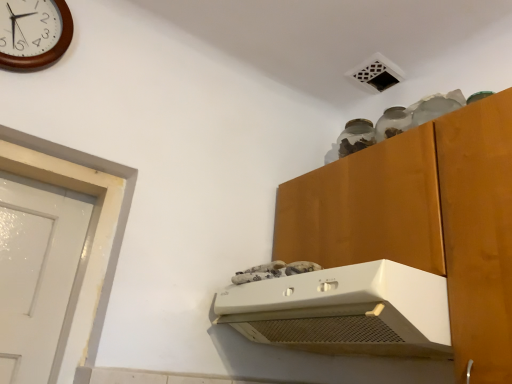
Question: Is white plastic range hood at upper center surrounded by wooden clock at upper left?

Choices:
 (A) yes
 (B) no

Answer: (B)

Question: From the image's perspective, is wooden clock at upper left over white plastic range hood at upper center?

Choices:
 (A) no
 (B) yes

Answer: (B)

Question: From the image's perspective, is wooden clock at upper left under white plastic range hood at upper center?

Choices:
 (A) yes
 (B) no

Answer: (B)

Question: Is wooden clock at upper left beside white plastic range hood at upper center?

Choices:
 (A) yes
 (B) no

Answer: (B)

Question: From a real-world perspective, does wooden clock at upper left sit lower than white plastic range hood at upper center?

Choices:
 (A) yes
 (B) no

Answer: (B)

Question: Considering the relative sizes of wooden clock at upper left and white plastic range hood at upper center in the image provided, is wooden clock at upper left bigger than white plastic range hood at upper center?

Choices:
 (A) no
 (B) yes

Answer: (A)

Question: Is white plastic range hood at upper center oriented away from wooden clock at upper left?

Choices:
 (A) no
 (B) yes

Answer: (A)

Question: Is white plastic range hood at upper center in front of wooden clock at upper left?

Choices:
 (A) no
 (B) yes

Answer: (B)

Question: Considering the relative sizes of white plastic range hood at upper center and wooden clock at upper left in the image provided, is white plastic range hood at upper center smaller than wooden clock at upper left?

Choices:
 (A) yes
 (B) no

Answer: (B)

Question: Is white plastic range hood at upper center outside wooden clock at upper left?

Choices:
 (A) no
 (B) yes

Answer: (B)

Question: Is white plastic range hood at upper center at the right side of wooden clock at upper left?

Choices:
 (A) no
 (B) yes

Answer: (B)

Question: Is white plastic range hood at upper center wider than wooden clock at upper left?

Choices:
 (A) yes
 (B) no

Answer: (A)

Question: Is white plastic range hood at upper center in front of or behind wooden clock at upper left in the image?

Choices:
 (A) behind
 (B) front

Answer: (B)